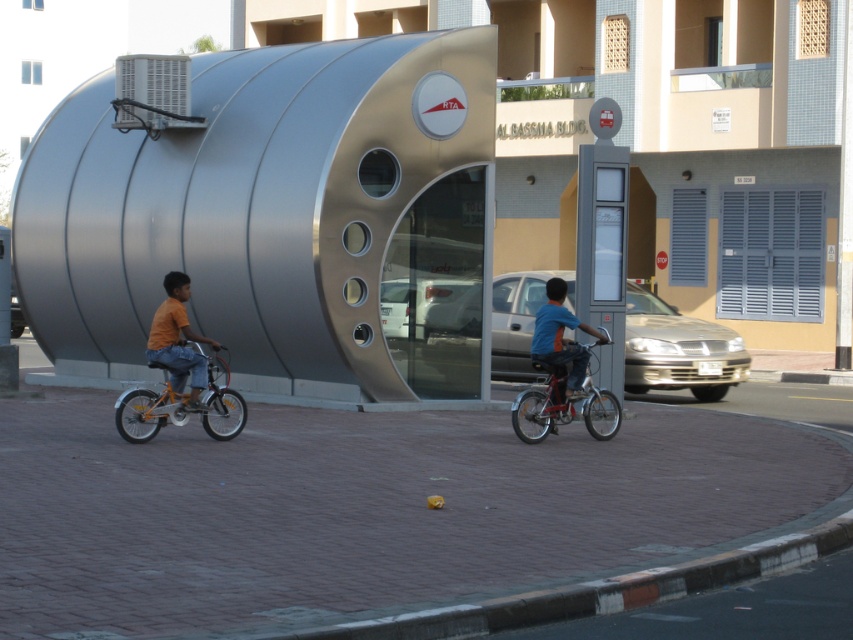
Does orange metallic bicycle at left appear on the left side of metallic red bicycle at center?

Correct, you'll find orange metallic bicycle at left to the left of metallic red bicycle at center.

Consider the image. Which is above, orange metallic bicycle at left or metallic red bicycle at center?

orange metallic bicycle at left

What do you see at coordinates (181, 404) in the screenshot? I see `orange metallic bicycle at left` at bounding box center [181, 404].

What are the coordinates of `orange metallic bicycle at left` in the screenshot? It's located at (181, 404).

Which is above, orange cotton shirt at left or blue fabric shirt at center?

Positioned higher is orange cotton shirt at left.

Measure the distance between point (x=148, y=349) and camera.

Point (x=148, y=349) is 15.54 meters from camera.

At what (x,y) coordinates should I click in order to perform the action: click on orange cotton shirt at left. Please return your answer as a coordinate pair (x, y). Looking at the image, I should click on (177, 339).

Who is taller, metallic red bicycle at center or orange cotton shirt at left?

orange cotton shirt at left

Can you confirm if metallic red bicycle at center is positioned to the left of orange cotton shirt at left?

Incorrect, metallic red bicycle at center is not on the left side of orange cotton shirt at left.

The width and height of the screenshot is (853, 640). Describe the element at coordinates (561, 406) in the screenshot. I see `metallic red bicycle at center` at that location.

You are a GUI agent. You are given a task and a screenshot of the screen. Output one action in this format:
    pyautogui.click(x=<x>, y=<y>)
    Task: Click on the metallic red bicycle at center
    
    Given the screenshot: What is the action you would take?
    pyautogui.click(x=561, y=406)